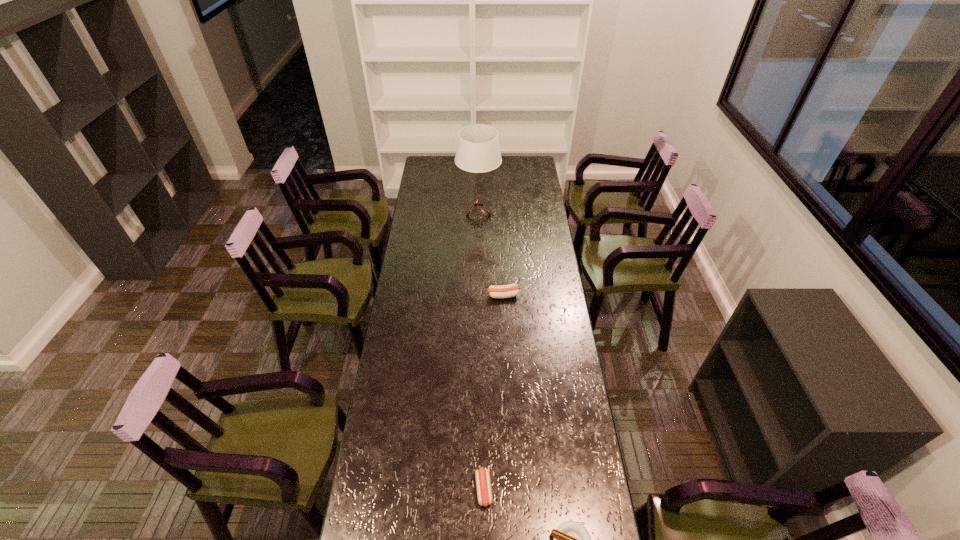
Locate which sausage is the second closest to the table lamp. Please provide its 2D coordinates. Your answer should be formatted as a tuple, i.e. [(x, y)], where the tuple contains the x and y coordinates of a point satisfying the conditions above.

[(484, 493)]

Where is `free spot that satisfies the following two spatial constraints: 1. on the front-facing side of the tallest object; 2. on the back side of the tallest sausage`? This screenshot has height=540, width=960. free spot that satisfies the following two spatial constraints: 1. on the front-facing side of the tallest object; 2. on the back side of the tallest sausage is located at coordinates (478, 295).

Locate an element on the screen. The image size is (960, 540). free space that satisfies the following two spatial constraints: 1. on the front-facing side of the table lamp; 2. on the back side of the second tallest object is located at coordinates (478, 295).

Where is `vacant area in the image that satisfies the following two spatial constraints: 1. on the front-facing side of the farthest object; 2. on the left side of the second nearest object`? vacant area in the image that satisfies the following two spatial constraints: 1. on the front-facing side of the farthest object; 2. on the left side of the second nearest object is located at coordinates (477, 489).

Find the location of a particular element. free space that satisfies the following two spatial constraints: 1. on the front-facing side of the farthest object; 2. on the right side of the second farthest object is located at coordinates (478, 295).

At what (x,y) coordinates should I click in order to perform the action: click on vacant space that satisfies the following two spatial constraints: 1. on the back side of the second nearest object; 2. on the front-facing side of the farthest object. Please return your answer as a coordinate pair (x, y). Looking at the image, I should click on (482, 215).

Where is `vacant position in the image that satisfies the following two spatial constraints: 1. on the front-facing side of the farthest sausage; 2. on the right side of the farthest object`? The width and height of the screenshot is (960, 540). vacant position in the image that satisfies the following two spatial constraints: 1. on the front-facing side of the farthest sausage; 2. on the right side of the farthest object is located at coordinates (478, 295).

Find the location of a particular element. This screenshot has height=540, width=960. free spot that satisfies the following two spatial constraints: 1. on the front-facing side of the table lamp; 2. on the right side of the second shortest sausage is located at coordinates [477, 489].

Where is `free spot that satisfies the following two spatial constraints: 1. on the front-facing side of the second shortest sausage; 2. on the left side of the tallest object`? Image resolution: width=960 pixels, height=540 pixels. free spot that satisfies the following two spatial constraints: 1. on the front-facing side of the second shortest sausage; 2. on the left side of the tallest object is located at coordinates (477, 489).

Identify the location of free space that satisfies the following two spatial constraints: 1. on the back side of the farthest sausage; 2. on the left side of the second farthest sausage. The height and width of the screenshot is (540, 960). (483, 295).